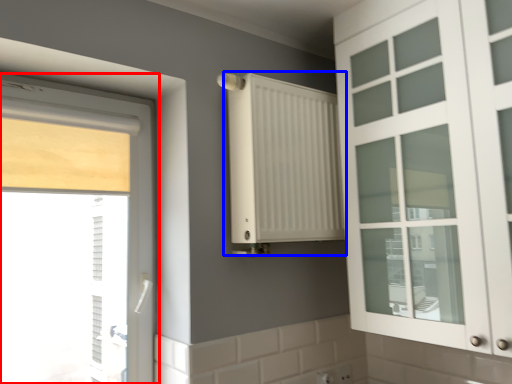
Question: Which object is closer to the camera taking this photo, window (highlighted by a red box) or radiator (highlighted by a blue box)?

Choices:
 (A) window
 (B) radiator

Answer: (A)